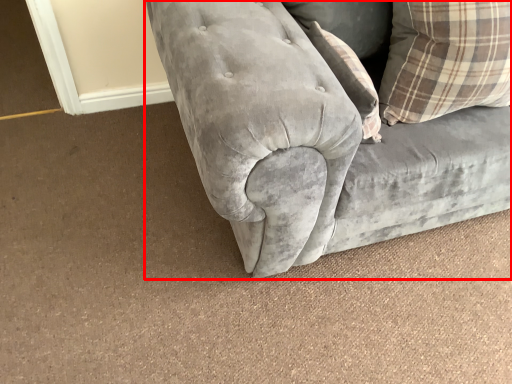
Question: Considering the relative positions of studio couch (annotated by the red box) and pillow in the image provided, where is studio couch (annotated by the red box) located with respect to the staircase?

Choices:
 (A) left
 (B) right

Answer: (B)